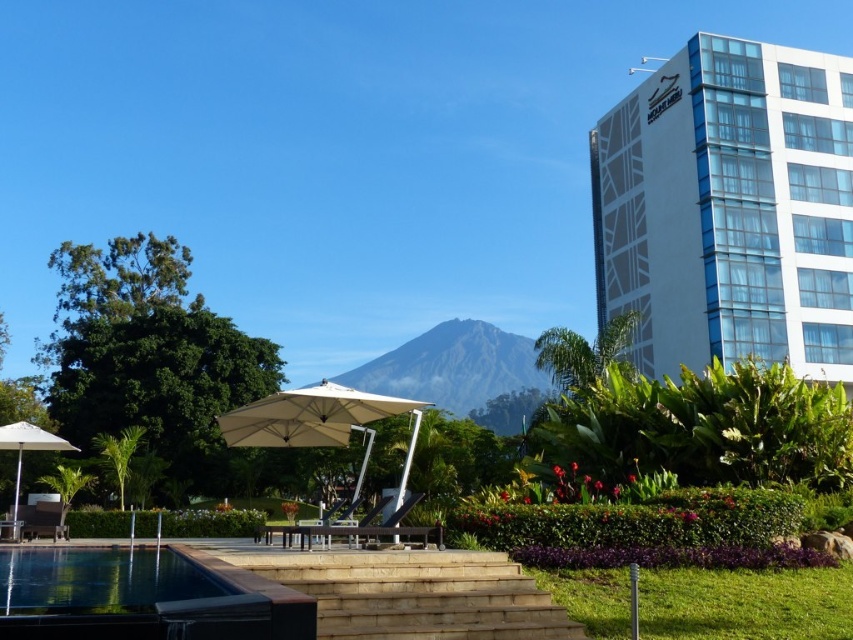
Is white glass building at upper right positioned before white matte umbrella at lower left?

No, white glass building at upper right is further to the viewer.

What do you see at coordinates (729, 209) in the screenshot? I see `white glass building at upper right` at bounding box center [729, 209].

Does point (691, 145) lie behind point (16, 440)?

That is True.

You are a GUI agent. You are given a task and a screenshot of the screen. Output one action in this format:
    pyautogui.click(x=<x>, y=<y>)
    Task: Click on the white glass building at upper right
    
    Given the screenshot: What is the action you would take?
    click(x=729, y=209)

Is point (601, 312) closer to camera compared to point (265, 433)?

No, (601, 312) is behind (265, 433).

Is white glass building at upper right positioned at the back of beige fabric umbrella at center?

Yes.

This screenshot has height=640, width=853. What do you see at coordinates (729, 209) in the screenshot?
I see `white glass building at upper right` at bounding box center [729, 209].

This screenshot has height=640, width=853. What are the coordinates of `white glass building at upper right` in the screenshot? It's located at (729, 209).

Is point (236, 440) more distant than point (3, 442)?

No, (236, 440) is closer to viewer.

Does beige fabric umbrella at center have a lesser width compared to white matte umbrella at lower left?

Indeed, beige fabric umbrella at center has a lesser width compared to white matte umbrella at lower left.

Is point (415, 401) positioned behind point (24, 422)?

Yes, point (415, 401) is behind point (24, 422).

Where is `beige fabric umbrella at center`? This screenshot has height=640, width=853. beige fabric umbrella at center is located at coordinates (317, 420).